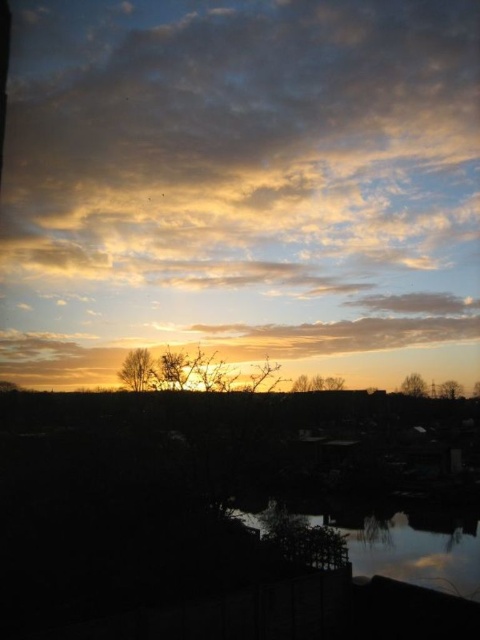
You are an astronomer analyzing the sunset image. You notice a point marked at coordinates (241, 186). Based on the scene description, what celestial object or feature is most likely located at that point?

The point at coordinates (241, 186) indicates a golden yellow cloud at the center of the image.